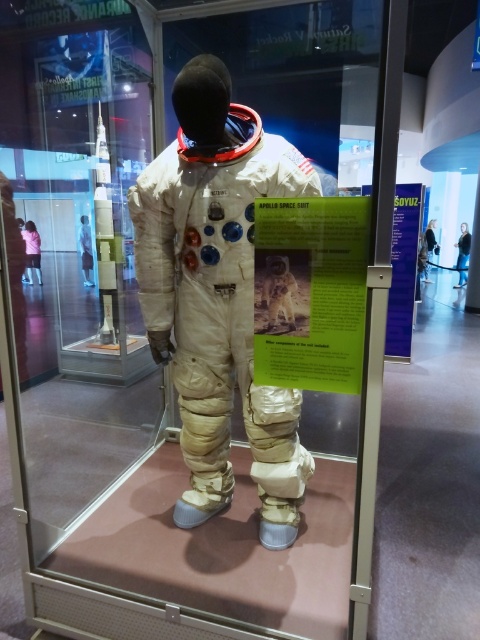
Question: Does white fabric astronaut at center appear over green paper at center?

Choices:
 (A) no
 (B) yes

Answer: (A)

Question: Which point appears farthest from the camera in this image?

Choices:
 (A) (337, 273)
 (B) (252, 138)

Answer: (B)

Question: Which object is the farthest from the green paper at center?

Choices:
 (A) purple paper at right
 (B) white fabric astronaut at center

Answer: (A)

Question: From the image, what is the correct spatial relationship of white fabric astronaut at center in relation to purple paper at right?

Choices:
 (A) right
 (B) left

Answer: (B)

Question: Which object is closer to the camera taking this photo?

Choices:
 (A) green paper at center
 (B) white fabric astronaut at center
 (C) purple paper at right

Answer: (A)

Question: Does white fabric astronaut at center appear on the right side of green paper at center?

Choices:
 (A) yes
 (B) no

Answer: (B)